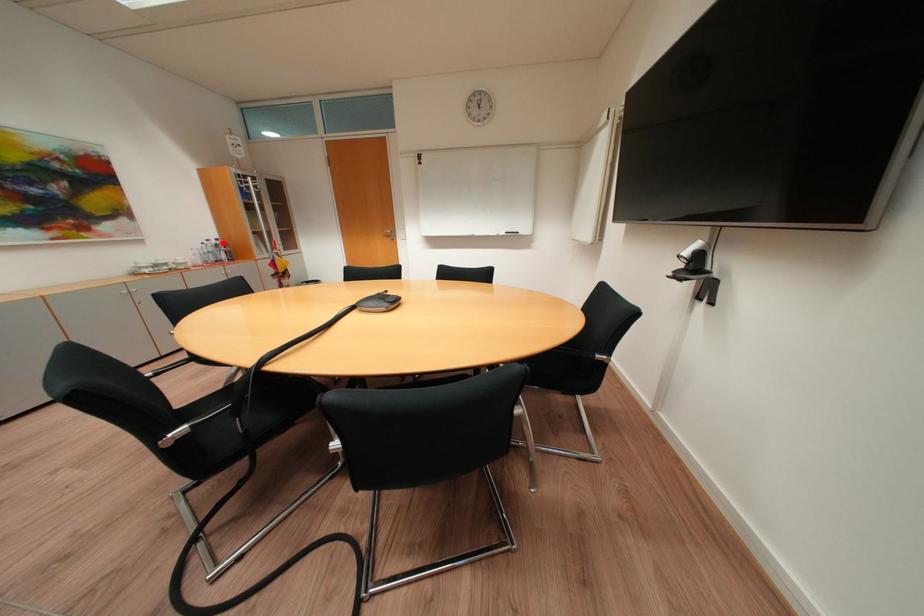
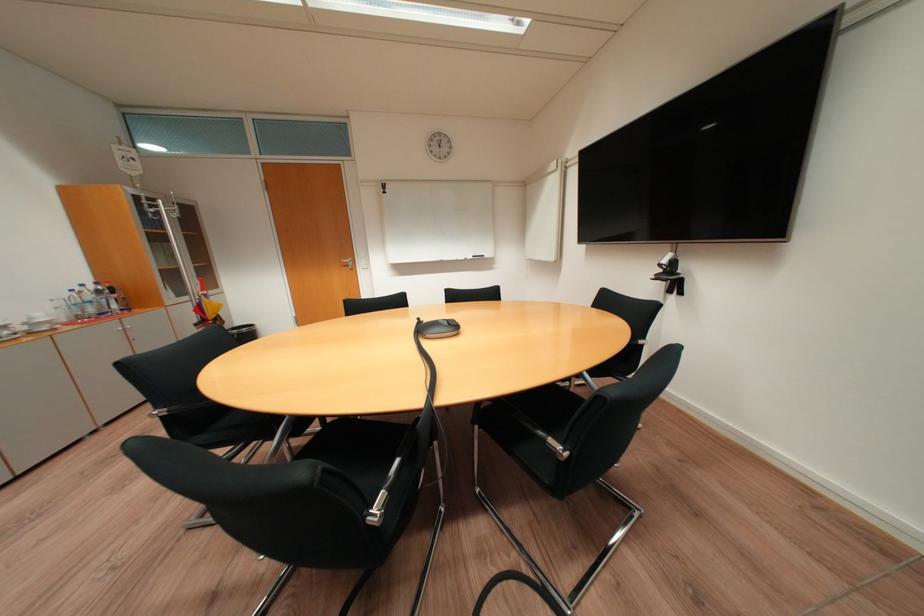
Locate, in the second image, the point that corresponds to the highlighted location in the first image.

(101, 288)